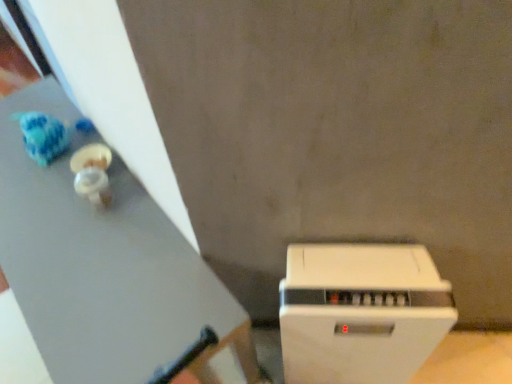
Question: Considering the relative sizes of white matte table at upper left and white plastic toaster at lower right in the image provided, is white matte table at upper left taller than white plastic toaster at lower right?

Choices:
 (A) no
 (B) yes

Answer: (A)

Question: Is there a large distance between white matte table at upper left and white plastic toaster at lower right?

Choices:
 (A) no
 (B) yes

Answer: (A)

Question: From the image's perspective, is white matte table at upper left located above white plastic toaster at lower right?

Choices:
 (A) yes
 (B) no

Answer: (A)

Question: Is the position of white matte table at upper left less distant than that of white plastic toaster at lower right?

Choices:
 (A) yes
 (B) no

Answer: (B)

Question: Does white matte table at upper left touch white plastic toaster at lower right?

Choices:
 (A) no
 (B) yes

Answer: (A)

Question: Is white matte table at upper left positioned behind white plastic toaster at lower right?

Choices:
 (A) no
 (B) yes

Answer: (B)

Question: Considering the relative sizes of white plastic toaster at lower right and white matte table at upper left in the image provided, is white plastic toaster at lower right wider than white matte table at upper left?

Choices:
 (A) yes
 (B) no

Answer: (B)

Question: Is white plastic toaster at lower right looking in the opposite direction of white matte table at upper left?

Choices:
 (A) no
 (B) yes

Answer: (A)

Question: Is white plastic toaster at lower right facing towards white matte table at upper left?

Choices:
 (A) yes
 (B) no

Answer: (B)

Question: Is white matte table at upper left inside white plastic toaster at lower right?

Choices:
 (A) no
 (B) yes

Answer: (A)

Question: Does white plastic toaster at lower right have a lesser width compared to white matte table at upper left?

Choices:
 (A) yes
 (B) no

Answer: (A)

Question: Is white plastic toaster at lower right at the left side of white matte table at upper left?

Choices:
 (A) yes
 (B) no

Answer: (B)

Question: Is point (180, 337) closer or farther from the camera than point (362, 269)?

Choices:
 (A) closer
 (B) farther

Answer: (B)